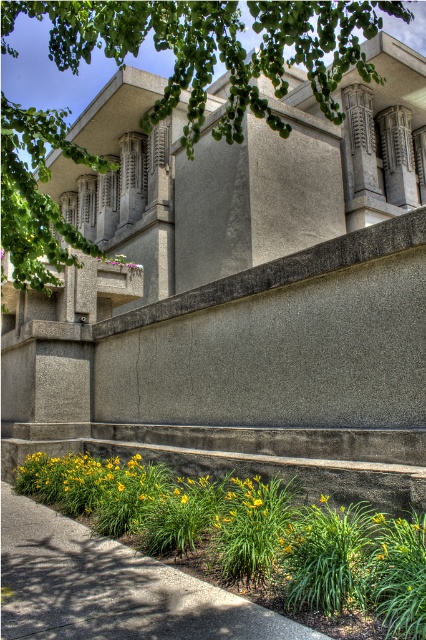
You are standing in front of the modernist building and want to walk from the green grass at lower left to the purple matte flower at upper center. Which direction should you move first?

You should move to the left first because the green grass at lower left is to the right of the purple matte flower at upper center, so moving left will bring you closer to it.

You are a landscape architect designing a garden in front of the modernist building. You have two plants to place on the sloping concrete step leading up to the building. The plants are the green leafy tree at upper center and the purple matte flower at upper center. Which plant should you place closer to the concrete wall to ensure proper visibility of both plants from the street?

The purple matte flower at upper center should be placed closer to the concrete wall because the green leafy tree at upper center is taller. This arrangement ensures that the shorter purple matte flower at upper center is not overshadowed by the taller green leafy tree at upper center, maintaining visibility from the street.

You are standing in front of the modernist building and notice a green leafy tree at upper center. Can you determine its exact position relative to the building?

The green leafy tree at upper center is located at point coordinates of (215,49), which indicates its precise position relative to the building.